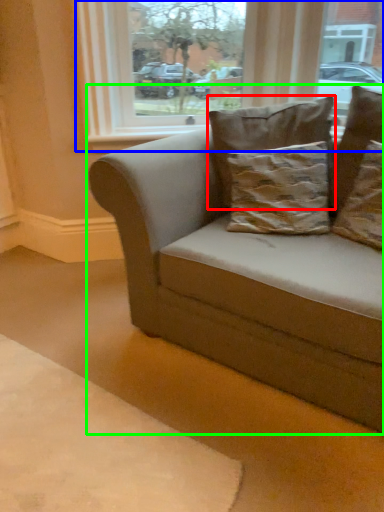
Question: Which is nearer to the pillow (highlighted by a red box)? window (highlighted by a blue box) or studio couch (highlighted by a green box).

Choices:
 (A) window
 (B) studio couch

Answer: (B)